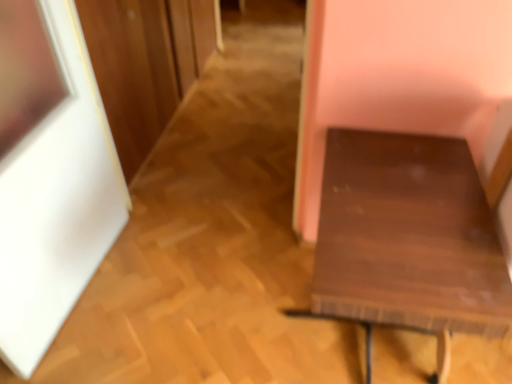
Question: Is point (376, 264) closer or farther from the camera than point (57, 139)?

Choices:
 (A) closer
 (B) farther

Answer: (A)

Question: From a real-world perspective, is dark wood table at right positioned above or below white matte picture frame at left?

Choices:
 (A) below
 (B) above

Answer: (A)

Question: From the image's perspective, is dark wood table at right above or below white matte picture frame at left?

Choices:
 (A) below
 (B) above

Answer: (A)

Question: Considering their positions, is white matte picture frame at left located in front of or behind dark wood table at right?

Choices:
 (A) front
 (B) behind

Answer: (A)

Question: Is white matte picture frame at left taller or shorter than dark wood table at right?

Choices:
 (A) short
 (B) tall

Answer: (B)

Question: From the image's perspective, is white matte picture frame at left positioned above or below dark wood table at right?

Choices:
 (A) below
 (B) above

Answer: (B)

Question: Considering the positions of white matte picture frame at left and dark wood table at right in the image, is white matte picture frame at left wider or thinner than dark wood table at right?

Choices:
 (A) thin
 (B) wide

Answer: (A)